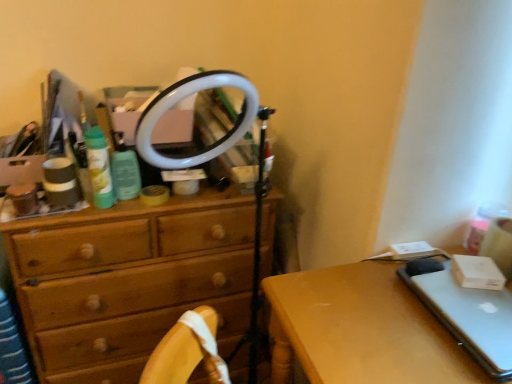
Where is `free point above silver metallic desk at lower right (from a real-world perspective)`? This screenshot has width=512, height=384. free point above silver metallic desk at lower right (from a real-world perspective) is located at coordinates (384, 318).